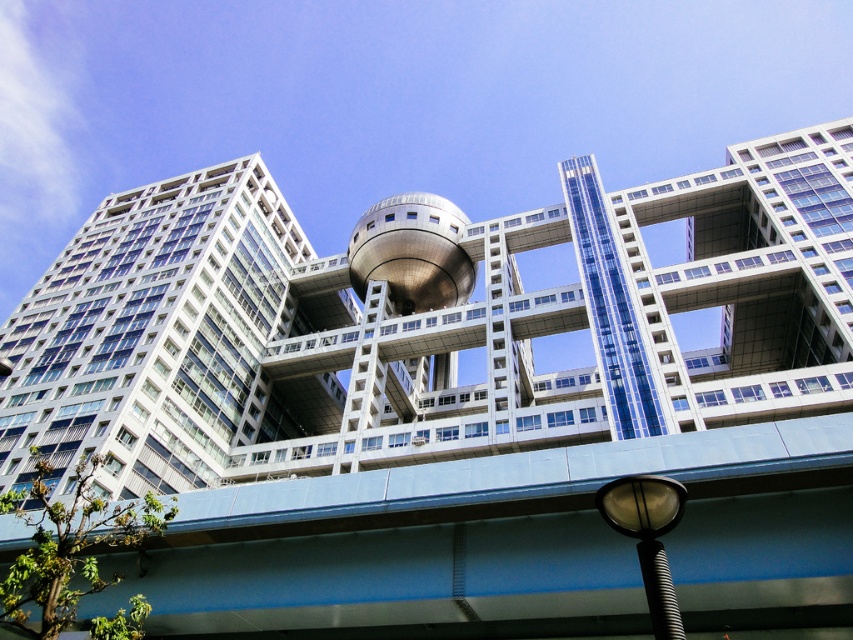
Question: Which point is closer to the camera?

Choices:
 (A) (96, 342)
 (B) (447, 289)
 (C) (250, 269)

Answer: (A)

Question: In this image, where is blue concrete overpass at center located relative to white glass building at left?

Choices:
 (A) right
 (B) left

Answer: (A)

Question: Can you confirm if blue concrete overpass at center is wider than white glass building at left?

Choices:
 (A) yes
 (B) no

Answer: (A)

Question: Which point is farther to the camera?

Choices:
 (A) white glass building at left
 (B) blue concrete overpass at center
 (C) sleek metallic sphere at center
 (D) metallic silver tower at center

Answer: (C)

Question: Does white glass building at left appear under sleek metallic sphere at center?

Choices:
 (A) no
 (B) yes

Answer: (B)

Question: Which is nearer to the sleek metallic sphere at center?

Choices:
 (A) metallic silver tower at center
 (B) blue concrete overpass at center

Answer: (A)